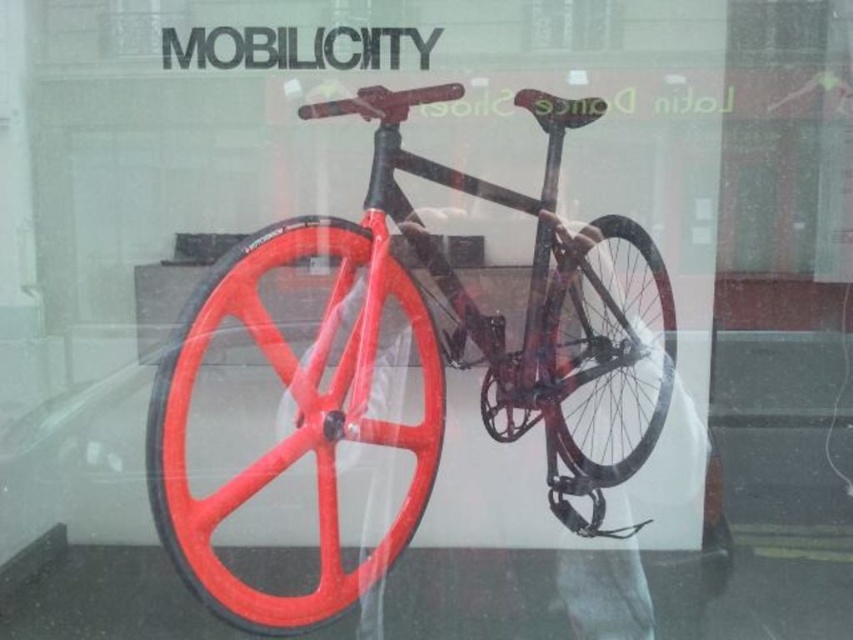
Between point (431, 442) and point (666, 321), which one is positioned in front?

Point (431, 442) is more forward.

The height and width of the screenshot is (640, 853). What are the coordinates of `shiny red rim at center` in the screenshot? It's located at [x=294, y=419].

Is the position of matte orange rimmed bicycle at center less distant than that of shiny red rim at center?

No, it is not.

Between matte orange rimmed bicycle at center and shiny red rim at center, which one appears on the right side from the viewer's perspective?

From the viewer's perspective, matte orange rimmed bicycle at center appears more on the right side.

Between point (370, 348) and point (320, 586), which one is positioned behind?

The point (320, 586) is behind.

Image resolution: width=853 pixels, height=640 pixels. Find the location of `matte orange rimmed bicycle at center`. matte orange rimmed bicycle at center is located at coordinates (416, 352).

Who is positioned more to the right, matte orange rimmed bicycle at center or matte black wheel at center?

Positioned to the right is matte black wheel at center.

Can you confirm if matte orange rimmed bicycle at center is positioned to the right of matte black wheel at center?

No, matte orange rimmed bicycle at center is not to the right of matte black wheel at center.

The width and height of the screenshot is (853, 640). What do you see at coordinates (416, 352) in the screenshot?
I see `matte orange rimmed bicycle at center` at bounding box center [416, 352].

This screenshot has width=853, height=640. I want to click on matte orange rimmed bicycle at center, so coord(416,352).